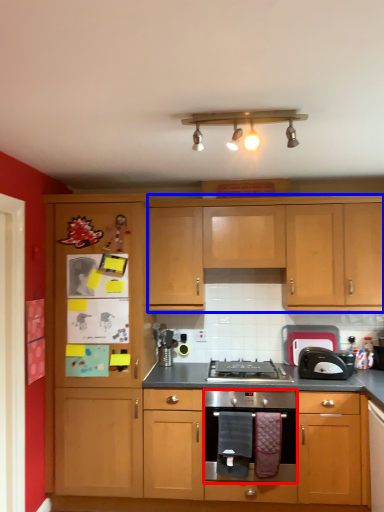
Question: Which object appears closest to the camera in this image, kitchen appliance (highlighted by a red box) or cabinetry (highlighted by a blue box)?

Choices:
 (A) kitchen appliance
 (B) cabinetry

Answer: (A)